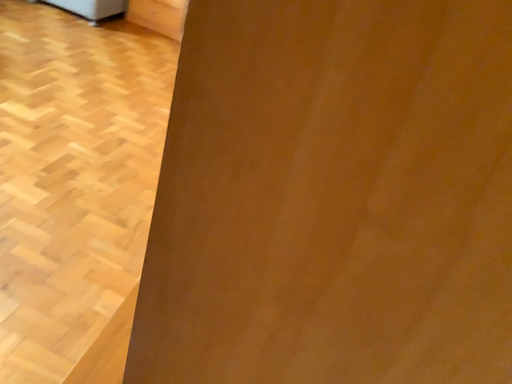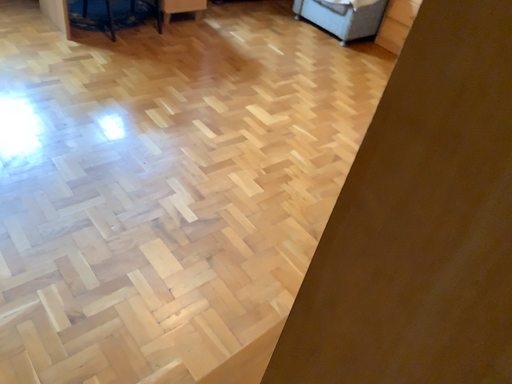
Question: How did the camera likely rotate when shooting the video?

Choices:
 (A) rotated right
 (B) rotated left

Answer: (B)